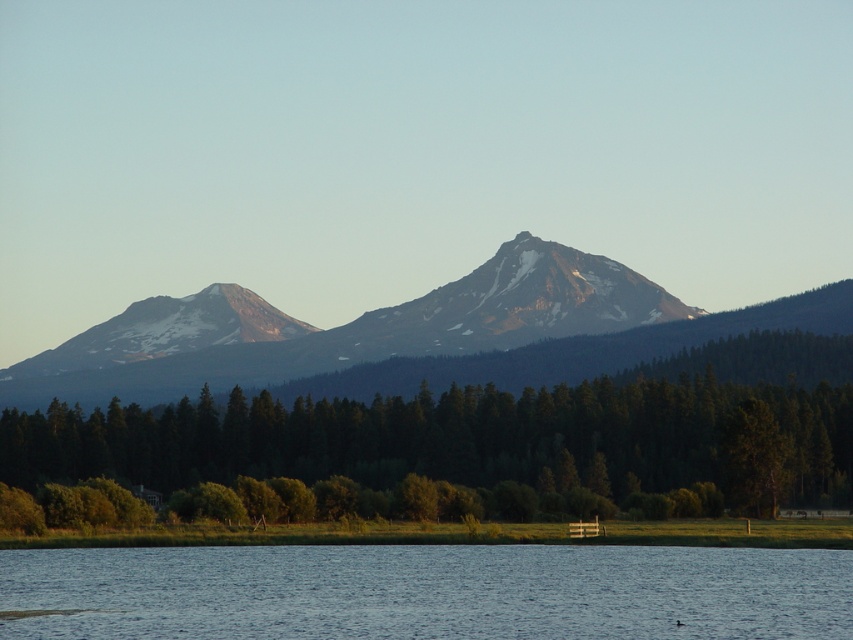
Question: Which object is positioned closest to the rocky gray mountain at center?

Choices:
 (A) sandy brown rock at upper center
 (B) green matte tree at center

Answer: (A)

Question: Which point appears closest to the camera in this image?

Choices:
 (A) (392, 400)
 (B) (502, 308)
 (C) (374, 604)

Answer: (C)

Question: Observing the image, what is the correct spatial positioning of green matte tree at center in reference to rocky gray mountain at center?

Choices:
 (A) left
 (B) right

Answer: (A)

Question: Is blue water at lower center further to camera compared to rocky gray mountain at center?

Choices:
 (A) yes
 (B) no

Answer: (B)

Question: Which of the following is the farthest from the observer?

Choices:
 (A) sandy brown rock at upper center
 (B) rocky gray mountain at center
 (C) blue water at lower center

Answer: (B)

Question: Is blue water at lower center positioned before sandy brown rock at upper center?

Choices:
 (A) no
 (B) yes

Answer: (B)